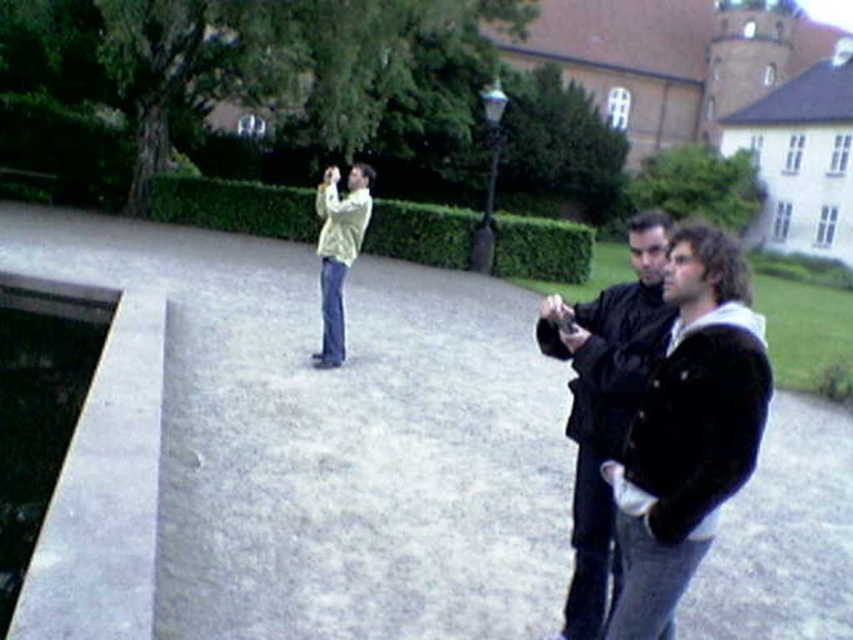
You are standing in the courtyard and want to take a photo of both the point at (643,179) and the point at (329,260). Which point will appear closer to the camera in the photo?

Point at (329,260) will appear closer to the camera in the photo because it is physically closer to the camera than point at (643,179), which is further away.

You are a photographer in the courtyard. You notice the green leafy hedge at center and the light yellow sweater at center. Which object is positioned lower from the ground?

The green leafy hedge at center is positioned lower from the ground than the light yellow sweater at center.

You are a photographer in the courtyard and want to take a clear photo of the light yellow sweater at center without the green leafy hedge at upper center blocking it. What should you do?

Move forward closer to the light yellow sweater at center so that it is no longer blocked by the green leafy hedge at upper center, since the light yellow sweater at center is currently behind the green leafy hedge at upper center.